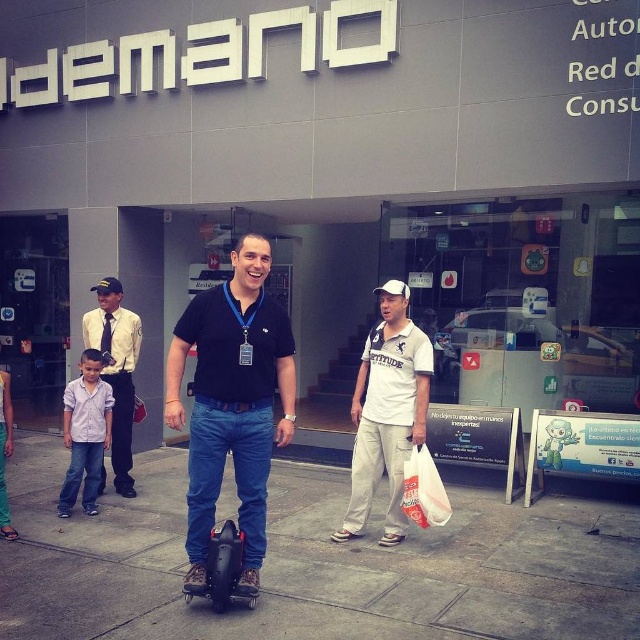
Is concrete at center closer to the viewer compared to matte black scooter at center?

No, concrete at center is further to the viewer.

Which is above, concrete at center or matte black scooter at center?

matte black scooter at center

Is point (280, 515) positioned after point (244, 276)?

Yes, it is.

Identify the location of concrete at center. (314, 564).

Which is more to the right, matte black scooter at center or white cotton shirt at center?

white cotton shirt at center

Is point (241, 328) closer to camera compared to point (406, 304)?

Yes, point (241, 328) is in front of point (406, 304).

Find the location of a particular element. This screenshot has width=640, height=640. matte black scooter at center is located at coordinates (232, 403).

From the picture: Can you confirm if white cotton shirt at center is smaller than purple cotton shirt at lower left?

No, white cotton shirt at center is not smaller than purple cotton shirt at lower left.

Which is above, white cotton shirt at center or purple cotton shirt at lower left?

white cotton shirt at center is above.

At what (x,y) coordinates should I click in order to perform the action: click on white cotton shirt at center. Please return your answer as a coordinate pair (x, y). The height and width of the screenshot is (640, 640). Looking at the image, I should click on (387, 412).

Where is `white cotton shirt at center`? This screenshot has width=640, height=640. white cotton shirt at center is located at coordinates (387, 412).